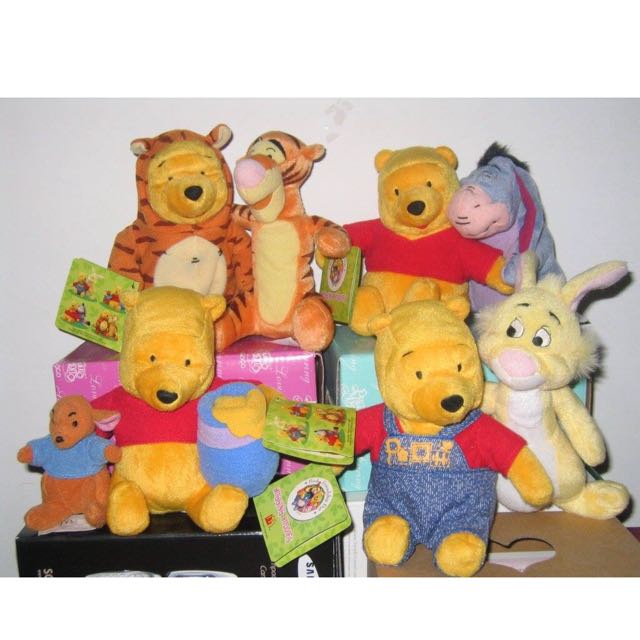
Identify the location of stuffed animals. point(153,470), point(436,484), point(415,248), point(59,451), point(531,404), point(287,267), point(426,237), point(509,198), point(185,234).